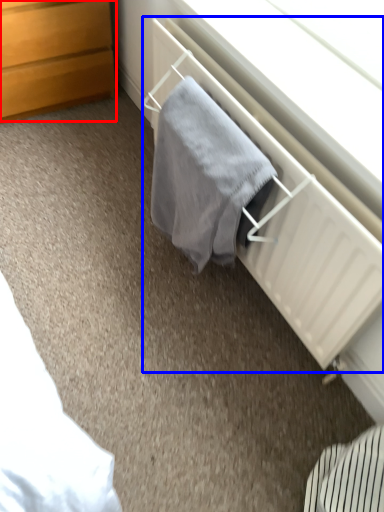
Question: Which of the following is the closest to the observer, chest of drawers (highlighted by a red box) or radiator (highlighted by a blue box)?

Choices:
 (A) chest of drawers
 (B) radiator

Answer: (B)